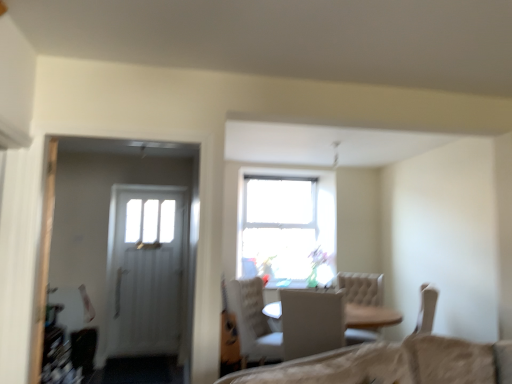
Question: From their relative heights in the image, would you say white fabric chair at center, the 1th chair when ordered from front to back, is taller or shorter than white textured chair at center, positioned as the first chair in back-to-front order?

Choices:
 (A) tall
 (B) short

Answer: (B)

Question: Choose the correct answer: Is white fabric chair at center, the 1th chair when ordered from front to back, inside white textured chair at center, the 2th chair viewed from the front, or outside it?

Choices:
 (A) outside
 (B) inside

Answer: (A)

Question: Is white fabric chair at center, the 1th chair when ordered from front to back, wider or thinner than white textured chair at center, the 2th chair viewed from the front?

Choices:
 (A) wide
 (B) thin

Answer: (A)

Question: In the image, is white textured chair at center, positioned as the first chair in back-to-front order, positioned in front of or behind white fabric chair at center, the 1th chair when ordered from front to back?

Choices:
 (A) behind
 (B) front

Answer: (A)

Question: Is point (278, 336) closer or farther from the camera than point (304, 350)?

Choices:
 (A) farther
 (B) closer

Answer: (A)

Question: In terms of width, does white textured chair at center, positioned as the first chair in back-to-front order, look wider or thinner when compared to white fabric chair at center, the 1th chair when ordered from front to back?

Choices:
 (A) thin
 (B) wide

Answer: (A)

Question: Would you say white textured chair at center, positioned as the first chair in back-to-front order, is to the left or to the right of white fabric chair at center, the 1th chair when ordered from front to back, in the picture?

Choices:
 (A) left
 (B) right

Answer: (A)